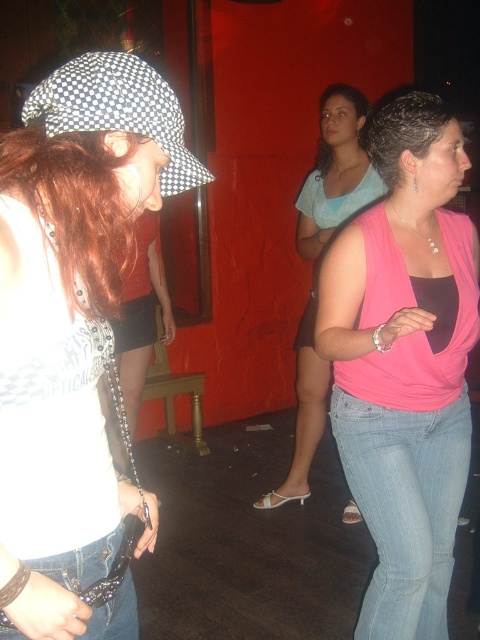
Which is in front, point (384, 268) or point (105, 564)?

Positioned in front is point (105, 564).

What do you see at coordinates (405, 364) in the screenshot? The height and width of the screenshot is (640, 480). I see `pink fabric top at center` at bounding box center [405, 364].

At what (x,y) coordinates should I click in order to perform the action: click on pink fabric top at center. Please return your answer as a coordinate pair (x, y). Looking at the image, I should click on (405, 364).

Identify the location of pink fabric top at center. (405, 364).

Is point (310, 308) farther from viewer compared to point (406, 99)?

That is True.

Can you confirm if pink matte tank top at center is thinner than dark curly hair at upper right?

Incorrect, pink matte tank top at center's width is not less than dark curly hair at upper right's.

Find the location of a particular element. pink matte tank top at center is located at coordinates (320, 262).

Does point (63, 160) come farther from viewer compared to point (388, 138)?

No, (63, 160) is in front of (388, 138).

Locate an element on the screen. shiny red hair at left is located at coordinates (73, 205).

Where is `shiny red hair at left`? shiny red hair at left is located at coordinates (73, 205).

Identify the location of shiny red hair at left. The height and width of the screenshot is (640, 480). (73, 205).